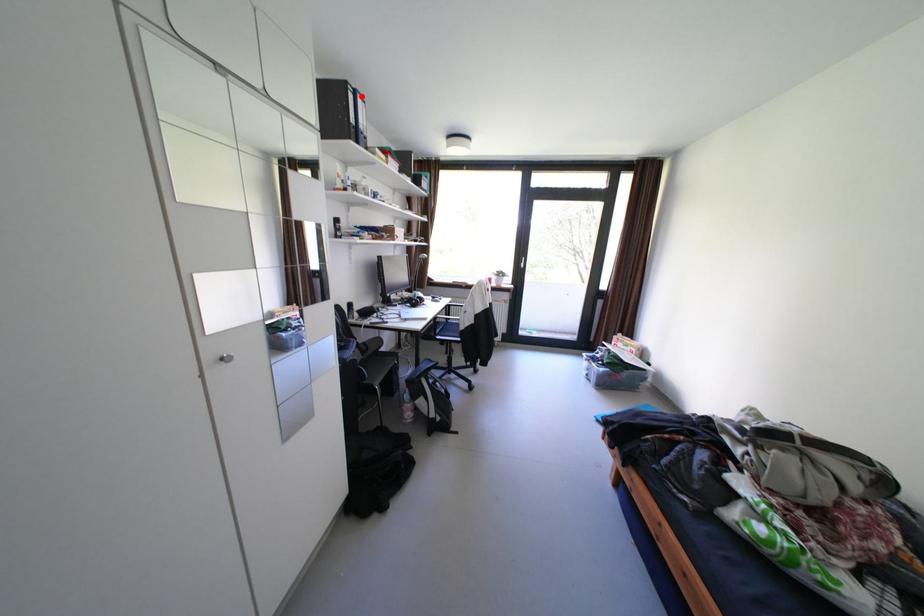
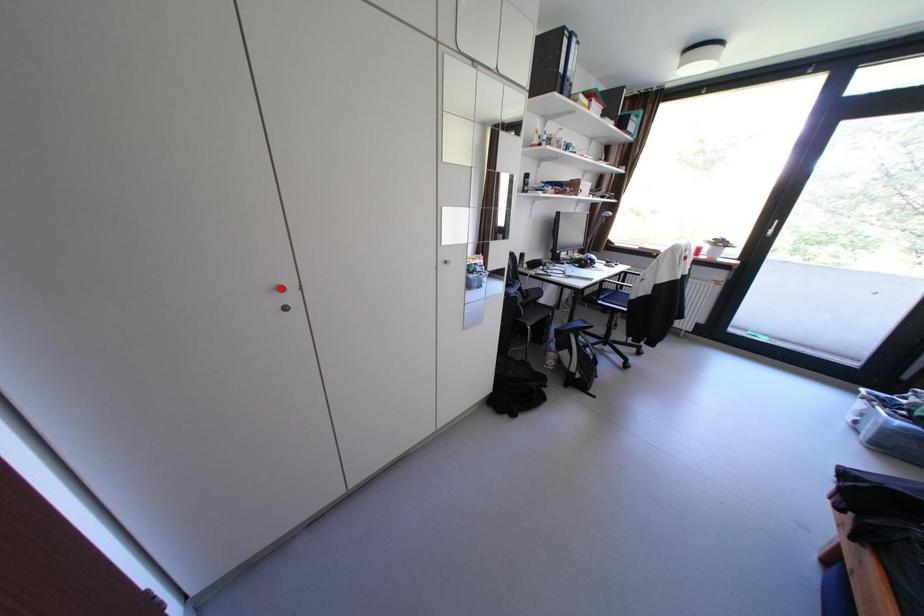
I am providing you with two images of the same scene from different viewpoints. A red point is marked on the first image and another point is marked on the second image. Does the point marked in image1 correspond to the same location as the one in image2?

No